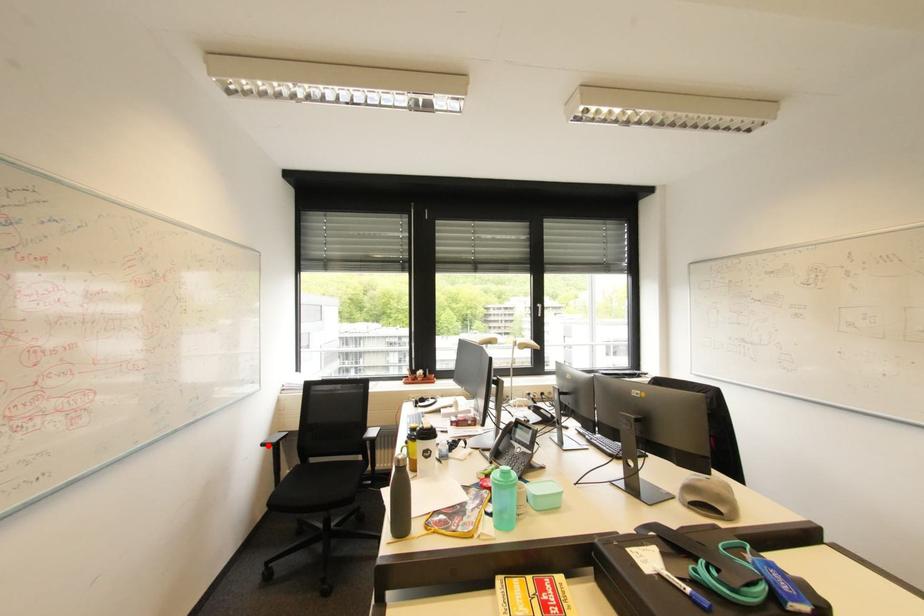
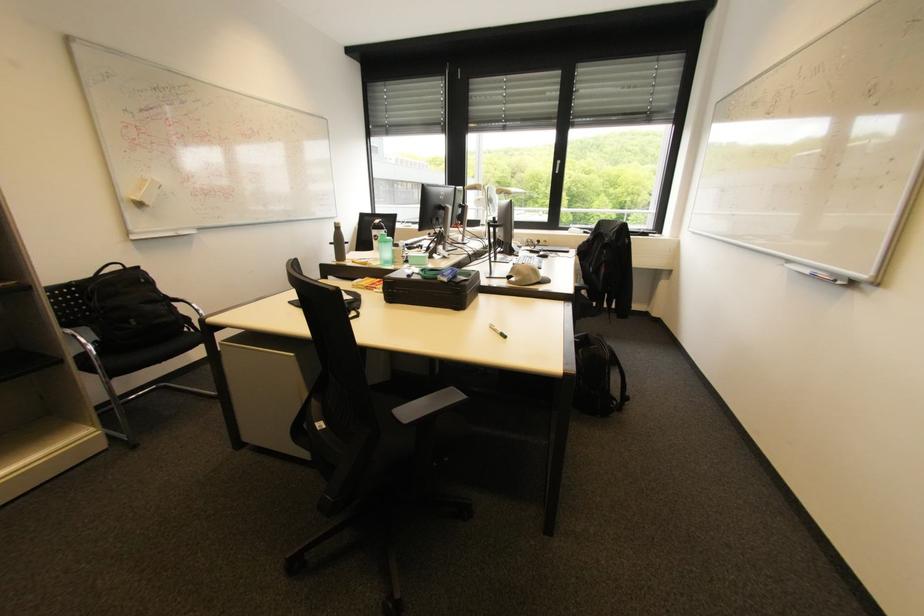
Question: I am providing you with two images of the same scene from different viewpoints. A red point is marked on the first image. Is the red point's position out of view in image 2?

Choices:
 (A) Yes
 (B) No

Answer: (B)